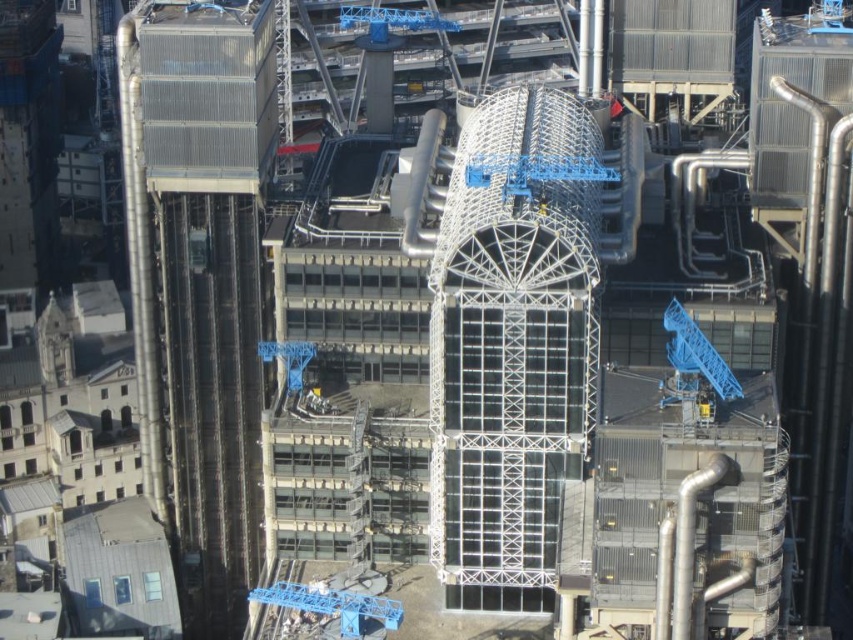
You are a drone operator tasked with capturing aerial footage of the construction site. You need to fly your drone to the point marked at coordinates point (199, 282). Based on the scene, can you confirm if this point is located on the metallic glass tower at left?

Yes, the point (199, 282) is on the metallic glass tower at left as described in the scene.

You are an engineer inspecting the construction site from above. You need to determine if the transparent glass tower at center is directly below the blue metallic crane at upper center. Based on the aerial view, is this true?

Yes, the transparent glass tower at center is positioned under the blue metallic crane at upper center, so it is directly below.

You are a drone operator tasked with capturing aerial footage of the construction site. Your drone is currently positioned above the metallic glass tower at left and the transparent glass tower at center. Which tower should you direct the drone to fly towards first if you want to capture a closer shot of the one that is nearer to you?

The metallic glass tower at left is closer to you than the transparent glass tower at center, so you should direct the drone to fly towards the metallic glass tower at left first to capture a closer shot.